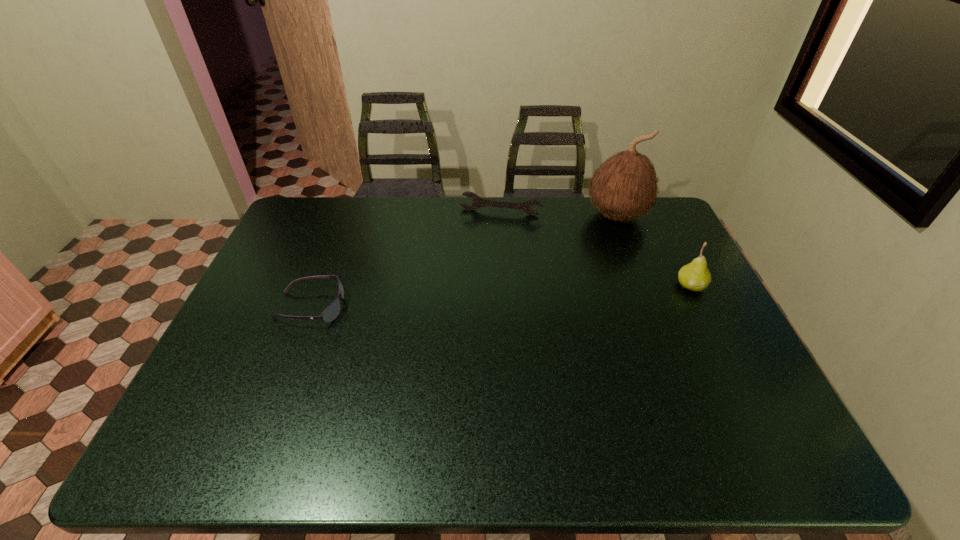
Where is `free space that satisfies the following two spatial constraints: 1. on the front side of the second shortest object; 2. on the left side of the tallest object`? This screenshot has width=960, height=540. free space that satisfies the following two spatial constraints: 1. on the front side of the second shortest object; 2. on the left side of the tallest object is located at coordinates (500, 215).